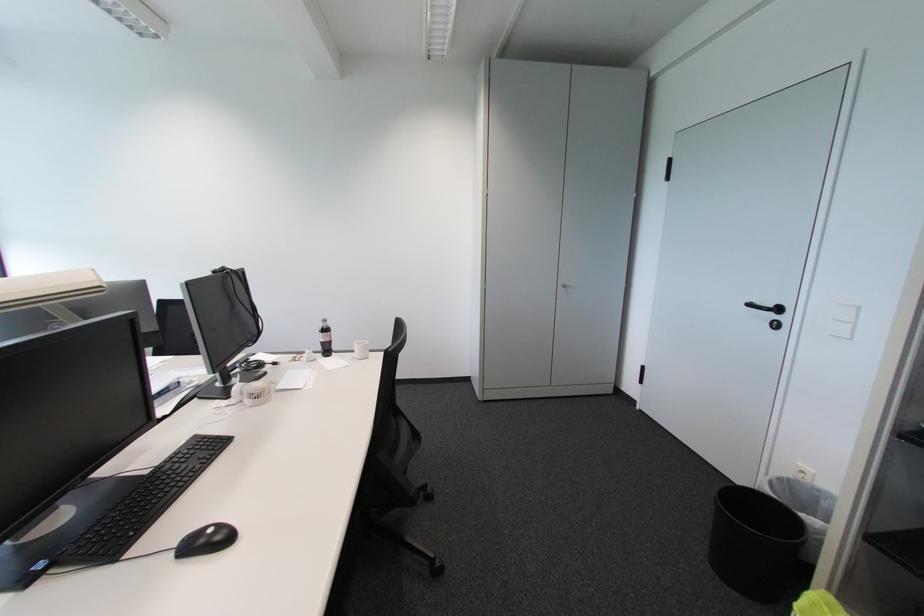
The width and height of the screenshot is (924, 616). Describe the element at coordinates (371, 468) in the screenshot. I see `a chair sitting surface` at that location.